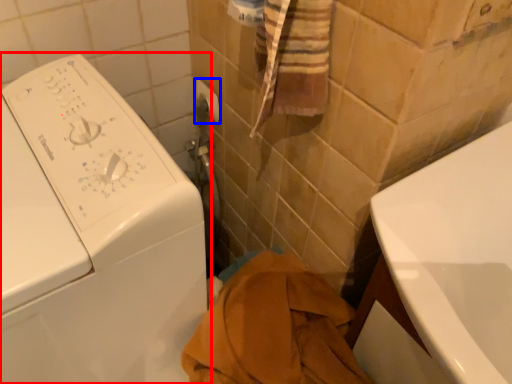
Question: Which of the following is the closest to the observer, washing machine (highlighted by a red box) or towel bar (highlighted by a blue box)?

Choices:
 (A) washing machine
 (B) towel bar

Answer: (A)